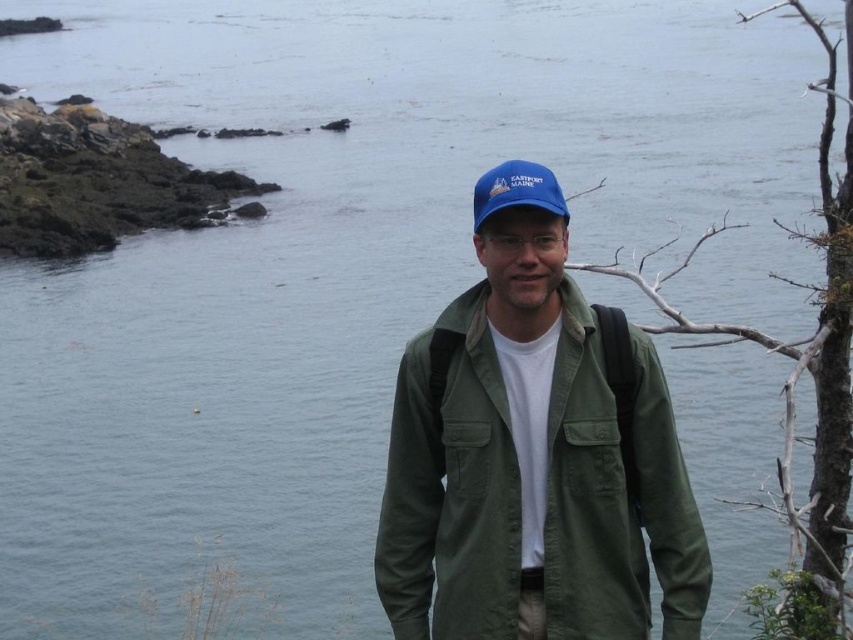
Does green cotton jacket at center appear under blue fabric cap at center?

Indeed, green cotton jacket at center is positioned under blue fabric cap at center.

Does green cotton jacket at center have a larger size compared to blue fabric cap at center?

No.

Who is more forward, (643,440) or (479,211)?

Positioned in front is point (479,211).

I want to click on green cotton jacket at center, so click(532, 465).